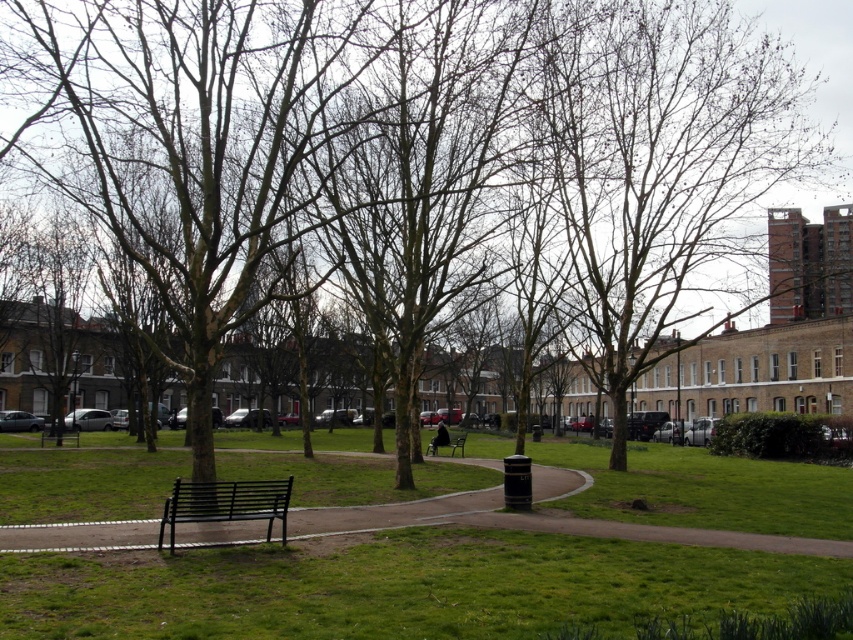
Describe the element at coordinates (398, 588) in the screenshot. The height and width of the screenshot is (640, 853). I see `green grass at center` at that location.

Which is below, green grass at center or smooth concrete path at center?

green grass at center is lower down.

Identify the location of green grass at center. (398, 588).

Between green grass at center and bare branches at center, which one appears on the left side from the viewer's perspective?

green grass at center is more to the left.

Which of these two, green grass at center or bare branches at center, stands shorter?

Standing shorter between the two is green grass at center.

Does point (512, 636) come in front of point (653, 58)?

That is True.

You are a GUI agent. You are given a task and a screenshot of the screen. Output one action in this format:
    pyautogui.click(x=<x>, y=<y>)
    Task: Click on the green grass at center
    The height and width of the screenshot is (640, 853).
    Given the screenshot: What is the action you would take?
    pyautogui.click(x=398, y=588)

Can you confirm if bare branches at center is positioned below metallic black bench at center?

Actually, bare branches at center is above metallic black bench at center.

Does point (759, 132) lie behind point (463, 451)?

No, it is in front of (463, 451).

The height and width of the screenshot is (640, 853). Identify the location of bare branches at center. (657, 161).